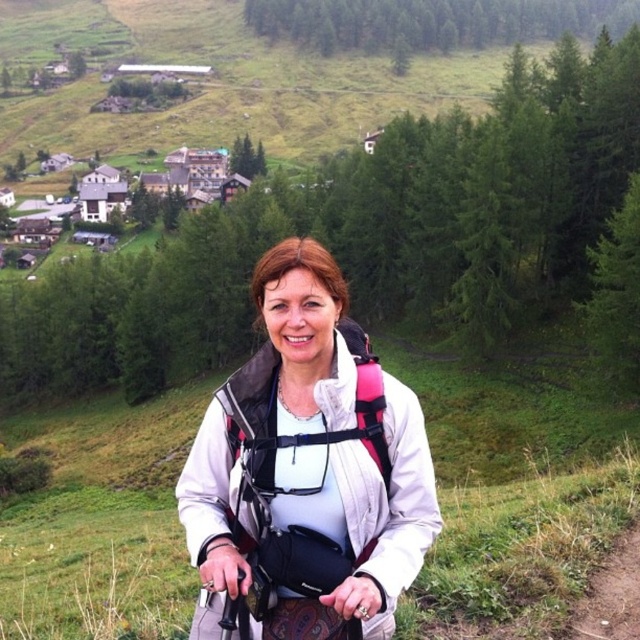
Question: Considering the relative positions of white matte jacket at center and pink fabric strap at center in the image provided, where is white matte jacket at center located with respect to pink fabric strap at center?

Choices:
 (A) left
 (B) right

Answer: (A)

Question: Which point is farther to the camera?

Choices:
 (A) white matte jacket at center
 (B) pink fabric strap at center

Answer: (B)

Question: Which point is farther to the camera?

Choices:
 (A) pink fabric strap at center
 (B) white matte jacket at center

Answer: (A)

Question: Does white matte jacket at center appear over pink fabric strap at center?

Choices:
 (A) yes
 (B) no

Answer: (A)

Question: Does white matte jacket at center have a lesser width compared to pink fabric strap at center?

Choices:
 (A) no
 (B) yes

Answer: (A)